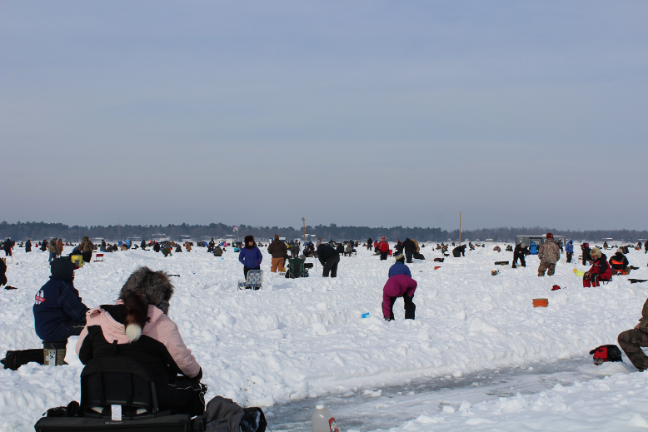
This screenshot has height=432, width=648. What are the coordinates of `bucket` in the screenshot? It's located at (52, 355).